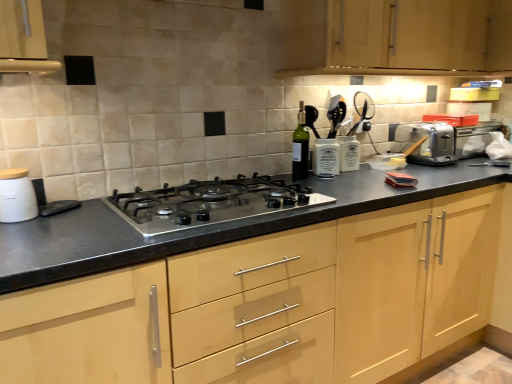
Question: Would you say light wood cabinet at upper center, the first cabinetry positioned from the top, is part of green glass bottle at center's contents?

Choices:
 (A) no
 (B) yes

Answer: (A)

Question: Does green glass bottle at center come in front of light wood cabinet at upper center, which is the 2th cabinetry from bottom to top?

Choices:
 (A) yes
 (B) no

Answer: (B)

Question: Does green glass bottle at center turn towards light wood cabinet at upper center, the first cabinetry positioned from the top?

Choices:
 (A) yes
 (B) no

Answer: (B)

Question: Does green glass bottle at center have a greater width compared to light wood cabinet at upper center, the first cabinetry positioned from the top?

Choices:
 (A) yes
 (B) no

Answer: (B)

Question: Can you confirm if green glass bottle at center is positioned to the right of light wood cabinet at upper center, the first cabinetry positioned from the top?

Choices:
 (A) yes
 (B) no

Answer: (B)

Question: Is white matte canister at left situated inside light wood cabinet at center, which is the second cabinetry in top-to-bottom order, or outside?

Choices:
 (A) inside
 (B) outside

Answer: (B)

Question: From a real-world perspective, is white matte canister at left physically located above or below light wood cabinet at center, which is the second cabinetry in top-to-bottom order?

Choices:
 (A) below
 (B) above

Answer: (B)

Question: Relative to light wood cabinet at center, which is the second cabinetry in top-to-bottom order, is white matte canister at left in front or behind?

Choices:
 (A) front
 (B) behind

Answer: (B)

Question: In terms of height, does white matte canister at left look taller or shorter compared to light wood cabinet at center, the first cabinetry when ordered from bottom to top?

Choices:
 (A) short
 (B) tall

Answer: (A)

Question: Is green glass bottle at center wider or thinner than light wood cabinet at upper center, which is the 2th cabinetry from bottom to top?

Choices:
 (A) thin
 (B) wide

Answer: (A)

Question: Considering the relative positions of green glass bottle at center and light wood cabinet at upper center, which is the 2th cabinetry from bottom to top, in the image provided, is green glass bottle at center to the left or to the right of light wood cabinet at upper center, which is the 2th cabinetry from bottom to top,?

Choices:
 (A) right
 (B) left

Answer: (B)

Question: Looking at the image, does green glass bottle at center seem bigger or smaller compared to light wood cabinet at upper center, which is the 2th cabinetry from bottom to top?

Choices:
 (A) small
 (B) big

Answer: (A)

Question: From a real-world perspective, is green glass bottle at center positioned above or below light wood cabinet at upper center, the first cabinetry positioned from the top?

Choices:
 (A) below
 (B) above

Answer: (A)

Question: Considering the positions of green glass bottle at center and satin black gas stove at center in the image, is green glass bottle at center taller or shorter than satin black gas stove at center?

Choices:
 (A) short
 (B) tall

Answer: (B)

Question: Do you think green glass bottle at center is within satin black gas stove at center, or outside of it?

Choices:
 (A) outside
 (B) inside

Answer: (A)